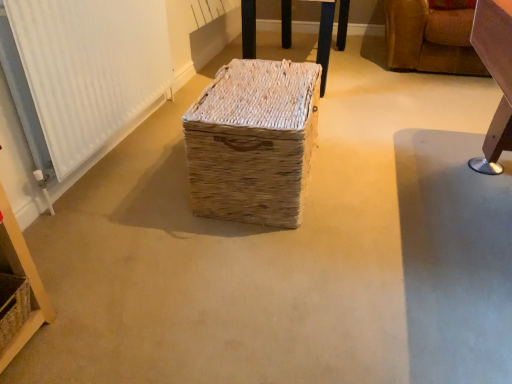
Question: In terms of height, does white textured radiator at left look taller or shorter compared to natural woven basket at lower left?

Choices:
 (A) short
 (B) tall

Answer: (B)

Question: Considering the positions of point (144, 61) and point (10, 319), is point (144, 61) closer or farther from the camera than point (10, 319)?

Choices:
 (A) closer
 (B) farther

Answer: (B)

Question: Which of these objects is positioned farthest from the white textured radiator at left?

Choices:
 (A) natural woven basket at lower left
 (B) natural woven basket at center, the second furniture positioned from the right
 (C) natural woven basket at center
 (D) leather sofa at upper right, which is the first furniture from right to left

Answer: (D)

Question: Based on their relative distances, which object is farther from the white textured radiator at left?

Choices:
 (A) natural woven basket at lower left
 (B) natural woven basket at center, the second furniture positioned from the right
 (C) leather sofa at upper right, which ranks as the second furniture in left-to-right order
 (D) natural woven basket at center

Answer: (C)